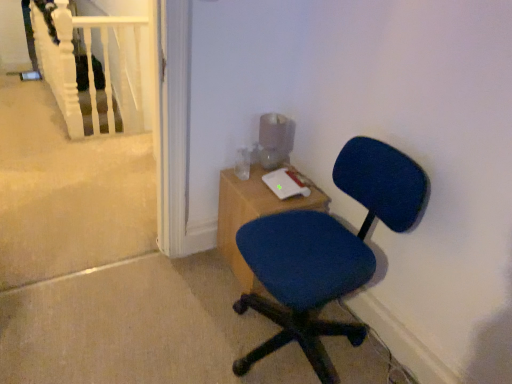
Image resolution: width=512 pixels, height=384 pixels. Find the location of `free area in between wooden desk at center and blue fabric chair at center`. free area in between wooden desk at center and blue fabric chair at center is located at coordinates (220, 289).